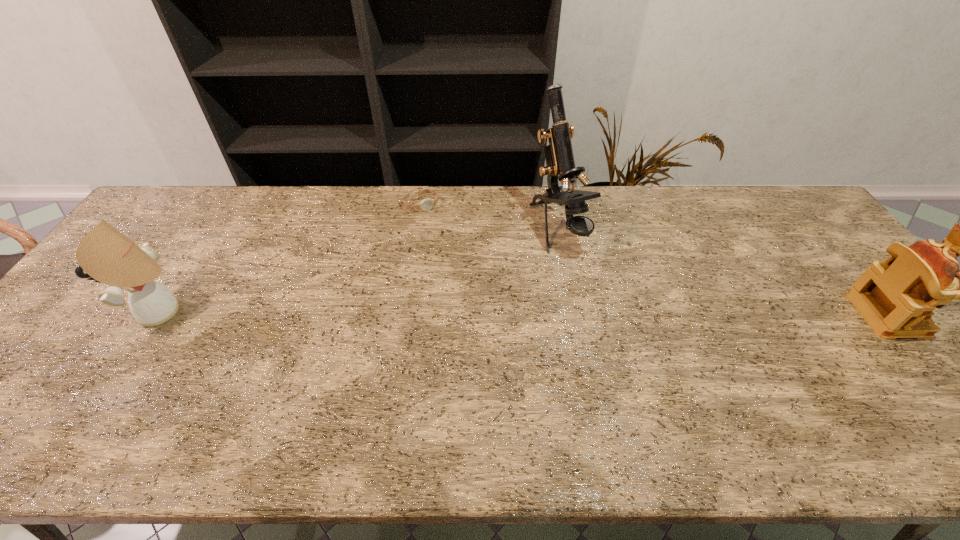
The width and height of the screenshot is (960, 540). I want to click on vacant area that lies between the doll and the third object from left to right, so click(x=362, y=271).

The image size is (960, 540). Find the location of `empty space between the leftmost object and the microscope`. empty space between the leftmost object and the microscope is located at coordinates coord(362,271).

In order to click on free space between the figurine and the tallest object in this screenshot , I will do `click(723, 273)`.

Identify which object is the nearest to the microscope. Please provide its 2D coordinates. Your answer should be formatted as a tuple, i.e. [(x, y)], where the tuple contains the x and y coordinates of a point satisfying the conditions above.

[(426, 204)]

Find the location of a particular element. Image resolution: width=960 pixels, height=540 pixels. object that is the third closest to the second object from left to right is located at coordinates (896, 297).

You are a GUI agent. You are given a task and a screenshot of the screen. Output one action in this format:
    pyautogui.click(x=<x>, y=<y>)
    Task: Click on the blank space that satisfies the following two spatial constraints: 1. on the front side of the figurine; 2. on the front-facing side of the second object from right to left
    
    Given the screenshot: What is the action you would take?
    pyautogui.click(x=576, y=315)

This screenshot has height=540, width=960. Identify the location of vacant position in the image that satisfies the following two spatial constraints: 1. on the front side of the tallest object; 2. on the front-facing side of the rightmost object. (576, 315).